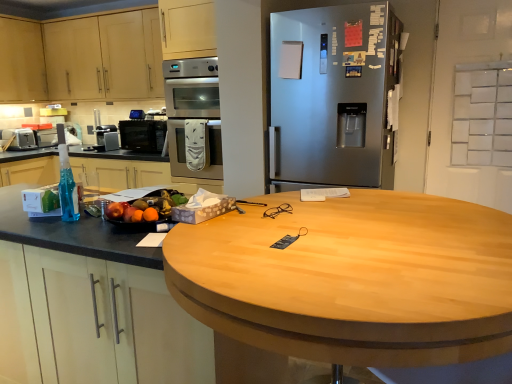
Question: From a real-world perspective, is satin silver coffee maker at center, the second appliance positioned from the left, physically located above or below light wood cabinet at upper left, the first cabinetry positioned from the right?

Choices:
 (A) above
 (B) below

Answer: (B)

Question: In the image, is satin silver coffee maker at center, the second appliance positioned from the left, positioned in front of or behind light wood cabinet at upper left, acting as the 2th cabinetry starting from the left?

Choices:
 (A) behind
 (B) front

Answer: (A)

Question: Considering the real-world distances, which object is closest to the matte black microwave at center?

Choices:
 (A) satin silver oven at center
 (B) matte wood cabinet at upper left, the 2th cabinetry viewed from the right
 (C) satin silver coffee maker at center, the second appliance positioned from the left
 (D) light wood cabinet at upper left, the first cabinetry positioned from the right
 (E) matte silver toaster at left, marked as the 1th appliance in a left-to-right arrangement

Answer: (C)

Question: Considering the real-world distances, which object is farthest from the satin silver refrigerator at center?

Choices:
 (A) light wood cabinet at upper left, the first cabinetry positioned from the right
 (B) satin silver oven at center
 (C) translucent blue liquid at left
 (D) wooden at left
 (E) matte black microwave at center

Answer: (A)